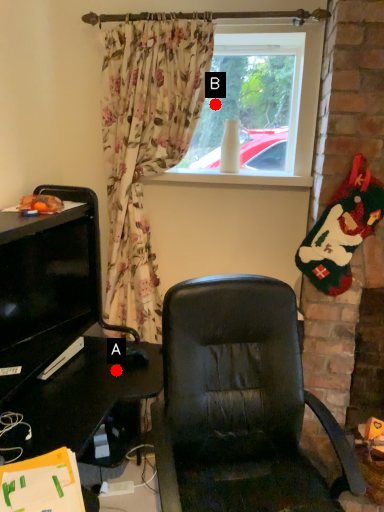
Question: Two points are circled on the image, labeled by A and B beside each circle. Which of the following is the closest to the observer?

Choices:
 (A) A is closer
 (B) B is closer

Answer: (A)